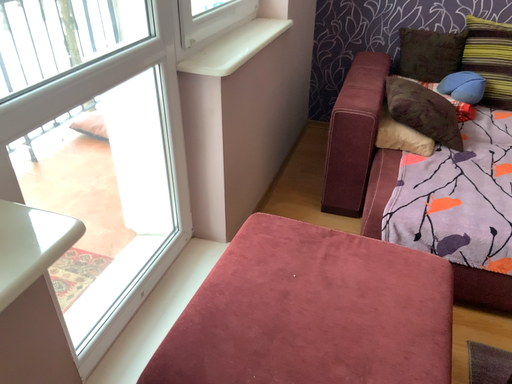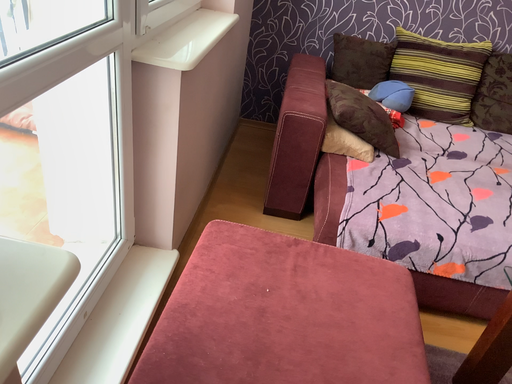
Question: How did the camera likely rotate when shooting the video?

Choices:
 (A) rotated left
 (B) rotated right

Answer: (B)